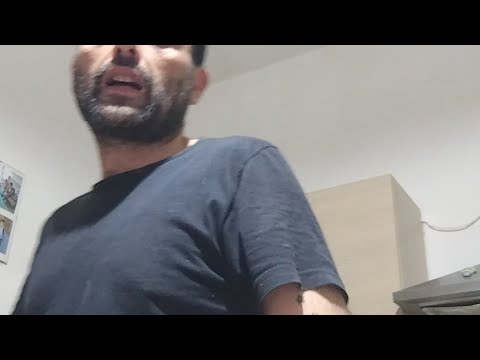
Locate an element on the screen. The image size is (480, 360). furniture is located at coordinates pos(458,284).